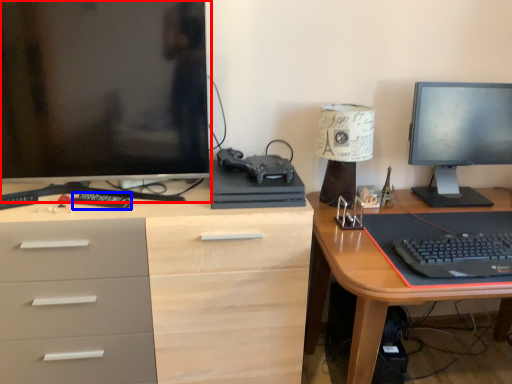
Question: Which object appears closest to the camera in this image, computer monitor (highlighted by a red box) or remote control (highlighted by a blue box)?

Choices:
 (A) computer monitor
 (B) remote control

Answer: (A)